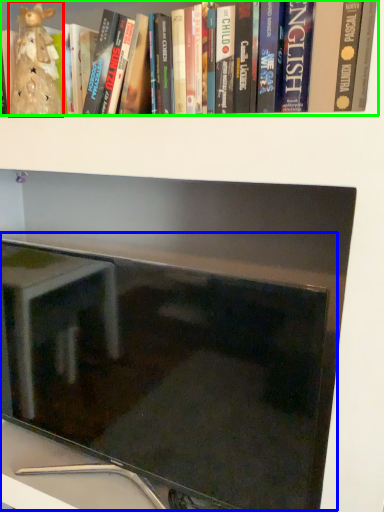
Question: Based on their relative distances, which object is farther from figurine (highlighted by a red box)? Choose from computer monitor (highlighted by a blue box) and book (highlighted by a green box).

Choices:
 (A) computer monitor
 (B) book

Answer: (A)